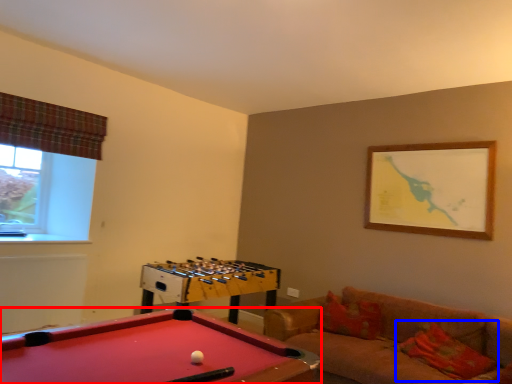
Question: Among these objects, which one is nearest to the camera, billiard table (highlighted by a red box) or pillow (highlighted by a blue box)?

Choices:
 (A) billiard table
 (B) pillow

Answer: (A)